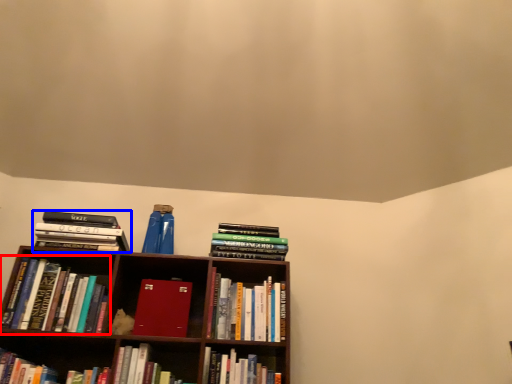
Question: Which object appears closest to the camera in this image, book (highlighted by a red box) or book (highlighted by a blue box)?

Choices:
 (A) book
 (B) book

Answer: (A)